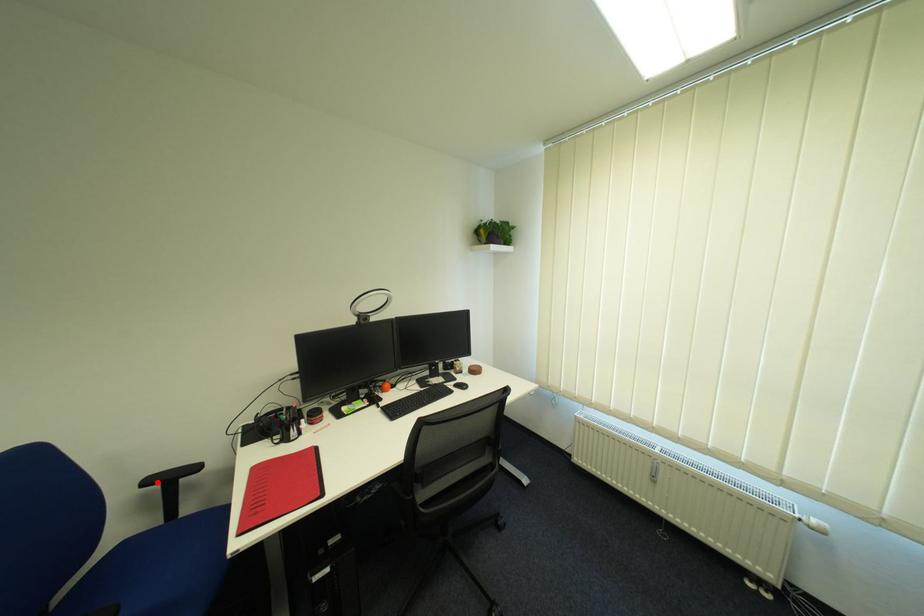
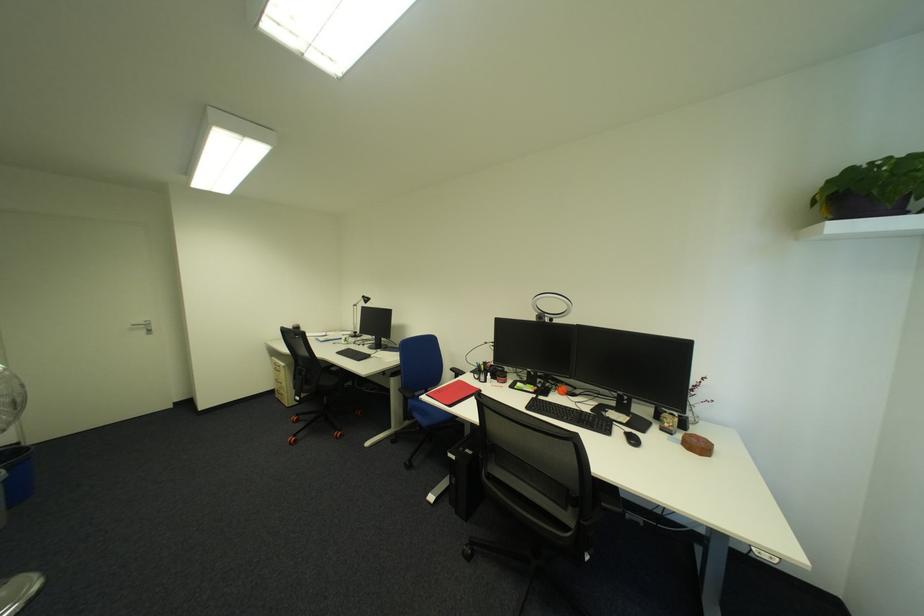
In the second image, find the point that corresponds to the highlighted location in the first image.

(462, 370)